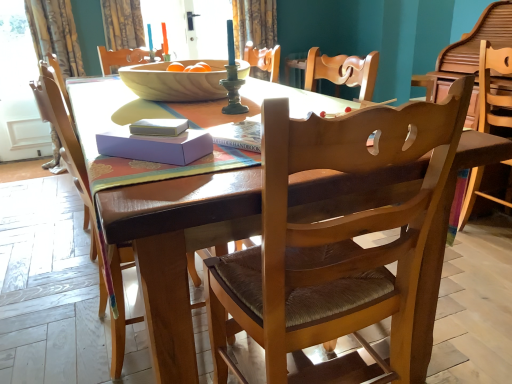
Question: Is white paper book at center positioned with its back to curtain at upper left?

Choices:
 (A) no
 (B) yes

Answer: (A)

Question: Is white paper book at center further to camera compared to curtain at upper left?

Choices:
 (A) yes
 (B) no

Answer: (B)

Question: From a real-world perspective, does white paper book at center stand above curtain at upper left?

Choices:
 (A) no
 (B) yes

Answer: (A)

Question: Is white paper book at center wider than curtain at upper left?

Choices:
 (A) yes
 (B) no

Answer: (B)

Question: Considering the relative sizes of white paper book at center and curtain at upper left in the image provided, is white paper book at center smaller than curtain at upper left?

Choices:
 (A) yes
 (B) no

Answer: (A)

Question: Is white paper book at center oriented towards curtain at upper left?

Choices:
 (A) yes
 (B) no

Answer: (B)

Question: Is lavender cardboard box at center with wooden chair at right, arranged as the 3th chair when viewed from the left?

Choices:
 (A) yes
 (B) no

Answer: (B)

Question: From the image's perspective, is lavender cardboard box at center below wooden chair at right, arranged as the 3th chair when viewed from the left?

Choices:
 (A) yes
 (B) no

Answer: (A)

Question: Can we say lavender cardboard box at center lies outside wooden chair at right, the first chair from the right?

Choices:
 (A) yes
 (B) no

Answer: (A)

Question: Is lavender cardboard box at center surrounding wooden chair at right, arranged as the 3th chair when viewed from the left?

Choices:
 (A) yes
 (B) no

Answer: (B)

Question: From a real-world perspective, is lavender cardboard box at center positioned under wooden chair at right, arranged as the 3th chair when viewed from the left, based on gravity?

Choices:
 (A) no
 (B) yes

Answer: (A)

Question: Is the position of lavender cardboard box at center more distant than that of wooden chair at right, the first chair from the right?

Choices:
 (A) no
 (B) yes

Answer: (A)

Question: Is wooden table at center not within white paper book at center?

Choices:
 (A) yes
 (B) no

Answer: (A)